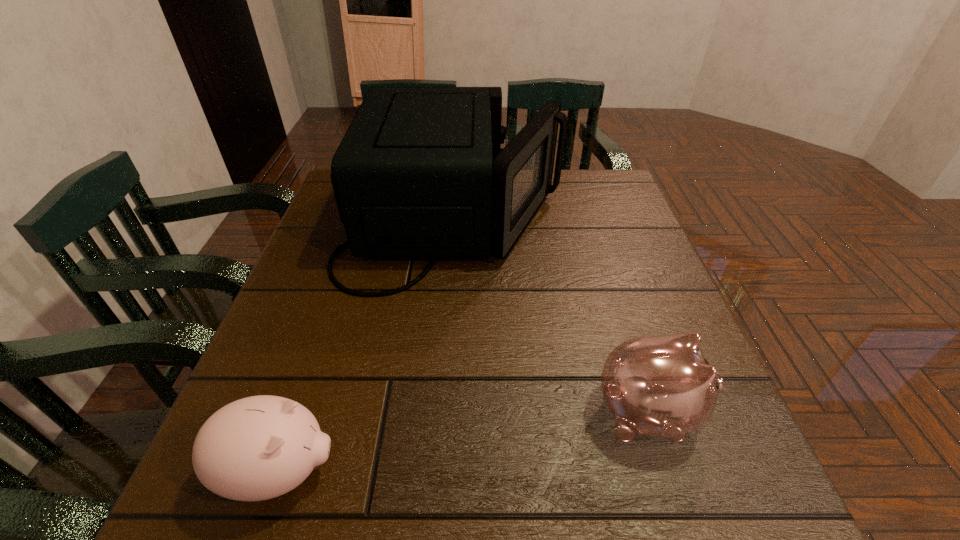
Identify the location of the second closest object to the left piggy bank. (662, 386).

Identify the location of free region that satisfies the following two spatial constraints: 1. with the door open on the tallest object; 2. on the front facing side of the right piggy bank. (440, 412).

The image size is (960, 540). In order to click on vacant space that satisfies the following two spatial constraints: 1. with the door open on the microwave oven; 2. on the front facing side of the right piggy bank in this screenshot , I will do `click(440, 412)`.

Where is `vacant space that satisfies the following two spatial constraints: 1. on the front facing side of the right piggy bank; 2. with the door open on the farthest object`? vacant space that satisfies the following two spatial constraints: 1. on the front facing side of the right piggy bank; 2. with the door open on the farthest object is located at coordinates (588, 221).

Locate an element on the screen. The image size is (960, 540). vacant position in the image that satisfies the following two spatial constraints: 1. on the front facing side of the right piggy bank; 2. with the door open on the tallest object is located at coordinates (588, 221).

You are a GUI agent. You are given a task and a screenshot of the screen. Output one action in this format:
    pyautogui.click(x=<x>, y=<y>)
    Task: Click on the vacant space that satisfies the following two spatial constraints: 1. on the front facing side of the right piggy bank; 2. with the door open on the tallest object
    The height and width of the screenshot is (540, 960).
    Given the screenshot: What is the action you would take?
    pyautogui.click(x=588, y=221)

Identify the location of free point that satisfies the following two spatial constraints: 1. with the door open on the farthest object; 2. on the front facing side of the right piggy bank. The height and width of the screenshot is (540, 960). (440, 412).

Identify the location of free space that satisfies the following two spatial constraints: 1. with the door open on the microwave oven; 2. on the front facing side of the right piggy bank. (440, 412).

Locate an element on the screen. The width and height of the screenshot is (960, 540). free location that satisfies the following two spatial constraints: 1. on the front facing side of the right piggy bank; 2. with the door open on the tallest object is located at coordinates pos(588,221).